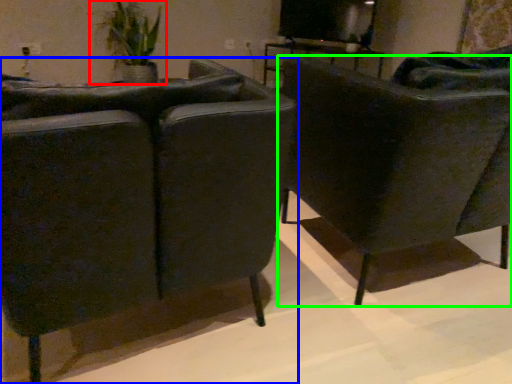
Question: Estimate the real-world distances between objects in this image. Which object is farther from houseplant (highlighted by a red box), chair (highlighted by a blue box) or chair (highlighted by a green box)?

Choices:
 (A) chair
 (B) chair

Answer: (A)